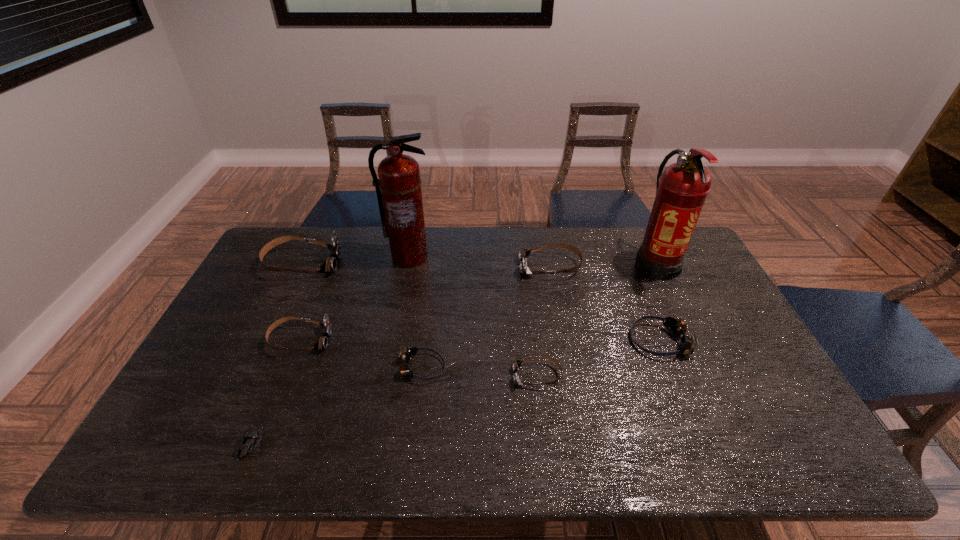
Locate an element on the screen. The height and width of the screenshot is (540, 960). the right red fire extinguisher is located at coordinates (681, 190).

This screenshot has height=540, width=960. What are the coordinates of `the left fire extinguisher` in the screenshot? It's located at (401, 207).

Locate an element on the screen. the tallest goggles is located at coordinates (330, 264).

Where is `the seventh shortest object`? This screenshot has height=540, width=960. the seventh shortest object is located at coordinates (330, 264).

Image resolution: width=960 pixels, height=540 pixels. In order to click on the second biggest brown goggles in this screenshot , I will do `click(523, 254)`.

This screenshot has width=960, height=540. What are the coordinates of `the bigger bronze goggles` in the screenshot? It's located at (677, 327).

Find the location of a particular element. The width and height of the screenshot is (960, 540). the right bronze goggles is located at coordinates (677, 327).

I want to click on the second smallest brown goggles, so click(322, 342).

The width and height of the screenshot is (960, 540). Identify the location of the smaller bronze goggles. (408, 353).

Locate an element on the screen. the left bronze goggles is located at coordinates (408, 353).